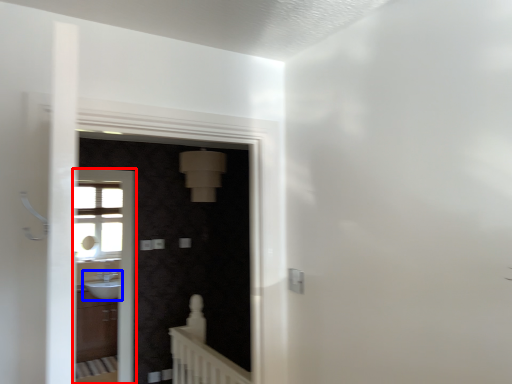
Question: Which object appears closest to the camera in this image, screen door (highlighted by a red box) or sink (highlighted by a blue box)?

Choices:
 (A) screen door
 (B) sink

Answer: (A)